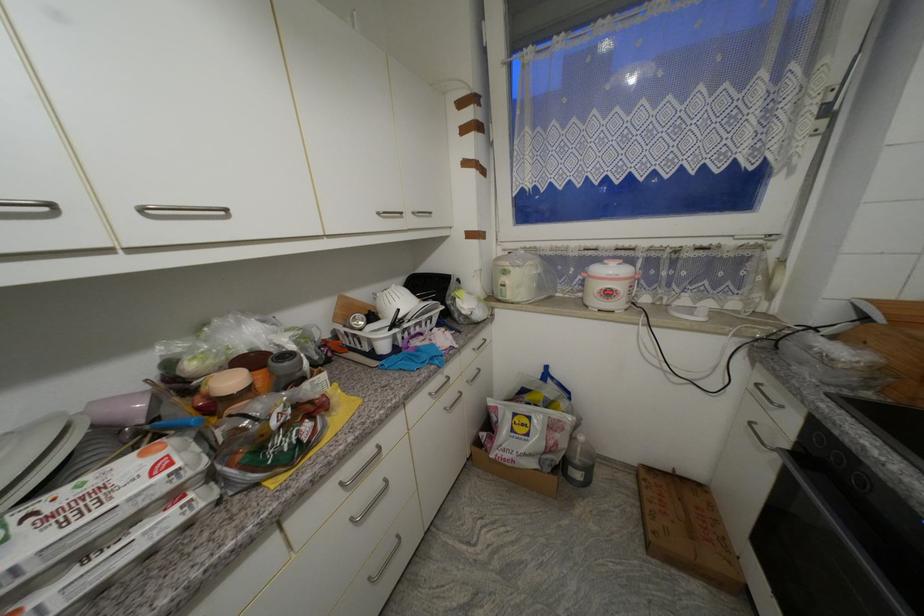
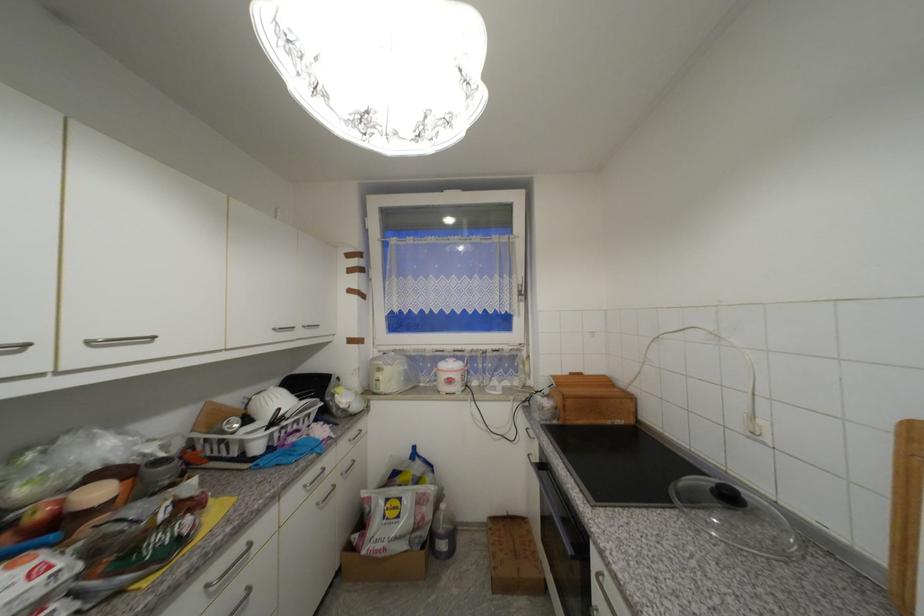
Locate, in the second image, the point that corresponds to [511,274] in the first image.

(385, 371)